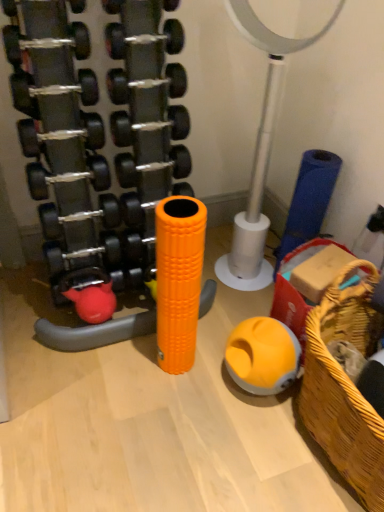
Question: Considering the positions of woven wood basket at lower right and rubberized yellow ball at center, which appears as the second toy when viewed from the left, in the image, is woven wood basket at lower right bigger or smaller than rubberized yellow ball at center, which appears as the second toy when viewed from the left,?

Choices:
 (A) big
 (B) small

Answer: (A)

Question: Is woven wood basket at lower right taller or shorter than rubberized yellow ball at center, which ranks as the 1th toy in right-to-left order?

Choices:
 (A) short
 (B) tall

Answer: (B)

Question: Which object is the farthest from the woven wood basket at lower right?

Choices:
 (A) metallic silver basketball hoop at center
 (B) rubberized yellow ball at center, which appears as the second toy when viewed from the left
 (C) orange foam roller at center, the 2th toy positioned from the right

Answer: (A)

Question: Which object is the farthest from the woven wood basket at lower right?

Choices:
 (A) metallic silver basketball hoop at center
 (B) orange foam roller at center, the 2th toy positioned from the right
 (C) rubberized yellow ball at center, which ranks as the 1th toy in right-to-left order

Answer: (A)